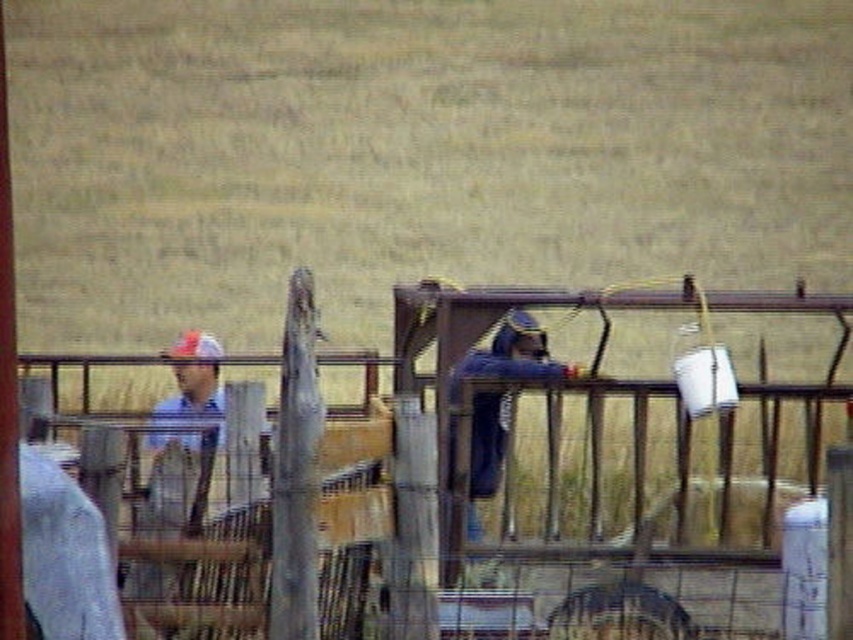
Who is higher up, blue denim shirt at left or blue denim jacket at center?

Positioned higher is blue denim shirt at left.

You are a GUI agent. You are given a task and a screenshot of the screen. Output one action in this format:
    pyautogui.click(x=<x>, y=<y>)
    Task: Click on the blue denim shirt at left
    The image size is (853, 640).
    Given the screenshot: What is the action you would take?
    point(186,435)

Find the location of a particular element. The image size is (853, 640). blue denim shirt at left is located at coordinates (186, 435).

Based on the photo, is brown wooden fence at center positioned at the back of blue denim shirt at left?

Yes, brown wooden fence at center is further from the viewer.

Is brown wooden fence at center thinner than blue denim shirt at left?

In fact, brown wooden fence at center might be wider than blue denim shirt at left.

Locate an element on the screen. The image size is (853, 640). brown wooden fence at center is located at coordinates (595, 484).

Between brown wooden fence at center and blue denim jacket at center, which one has less height?

brown wooden fence at center

Does brown wooden fence at center have a greater height compared to blue denim jacket at center?

No, brown wooden fence at center is not taller than blue denim jacket at center.

Does point (750, 593) lie in front of point (566, 364)?

Yes.

Where is `brown wooden fence at center`? brown wooden fence at center is located at coordinates (595, 484).